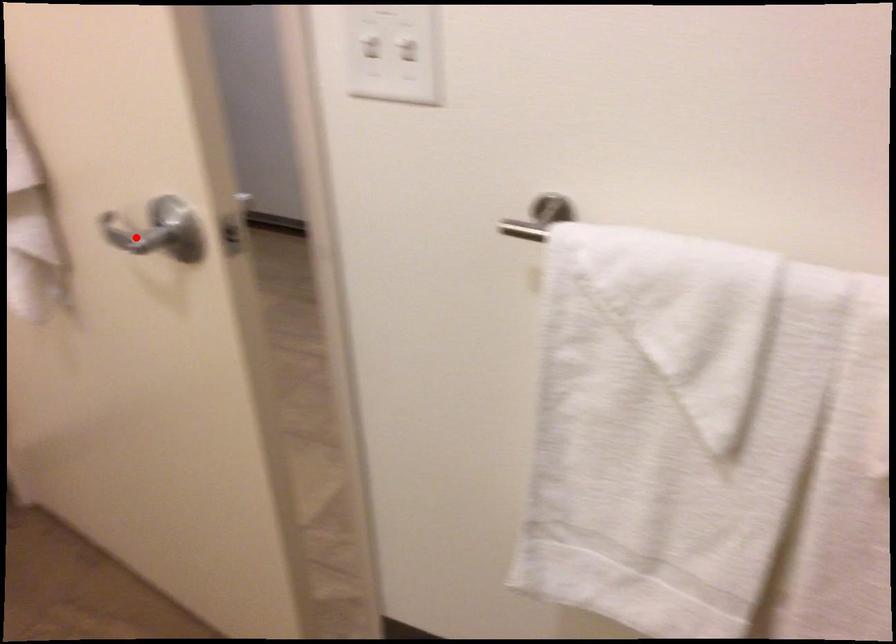
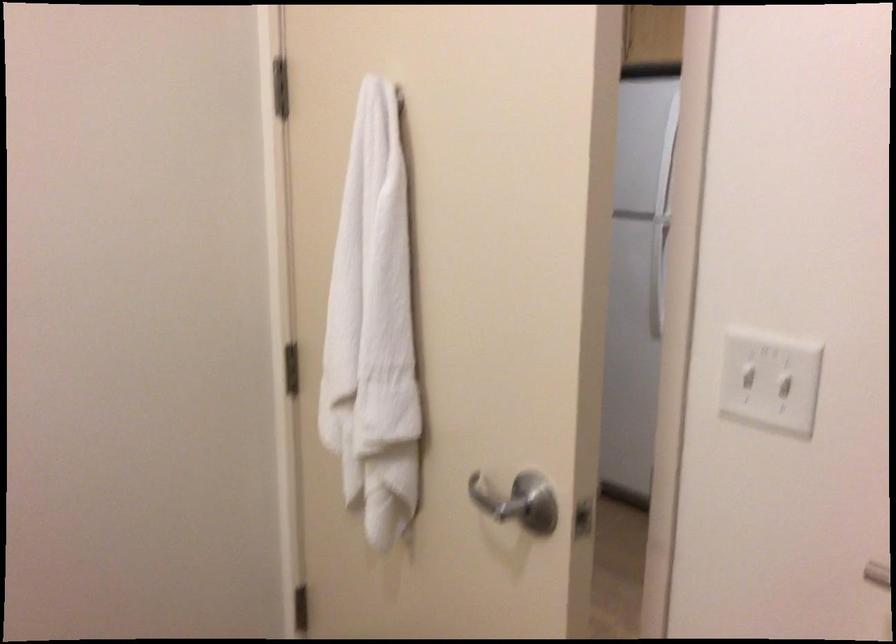
Question: I am providing you with two images of the same scene from different viewpoints. A red point is shown in image1. For the corresponding object point in image2, is it positioned nearer or farther from the camera?

Choices:
 (A) Nearer
 (B) Farther

Answer: (B)